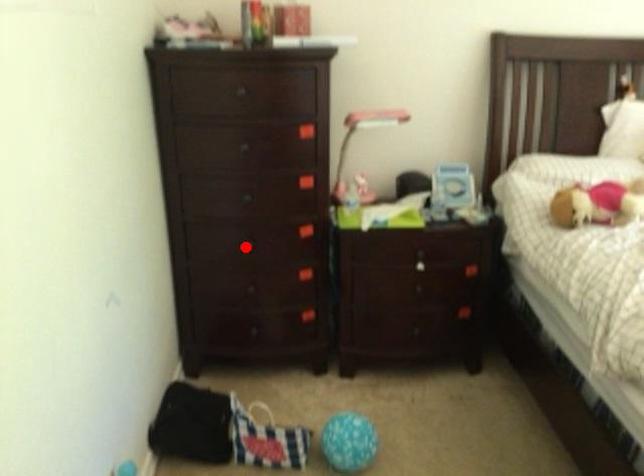
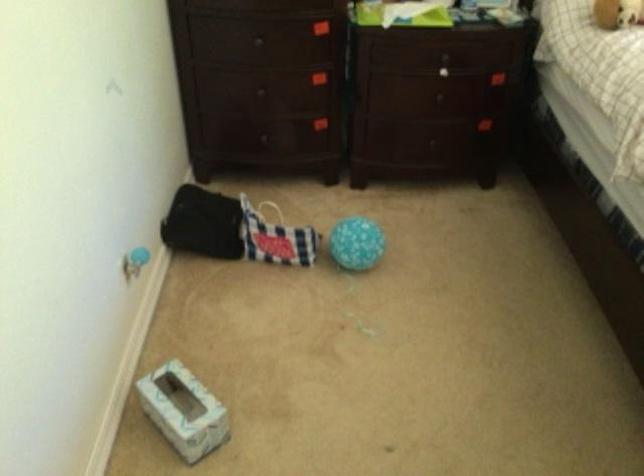
Where in the second image is the point corresponding to the highlighted location from the first image?

(260, 44)